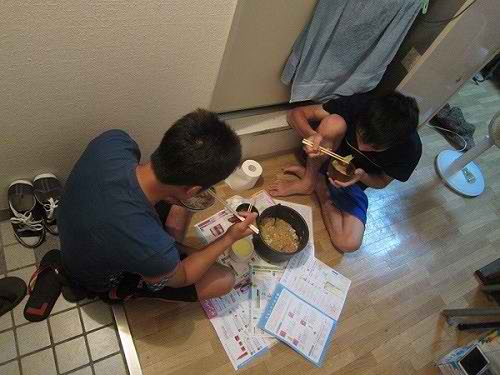
Image resolution: width=500 pixels, height=375 pixels. I want to click on chopsticks, so click(236, 214), click(234, 210), click(328, 154), click(327, 151).